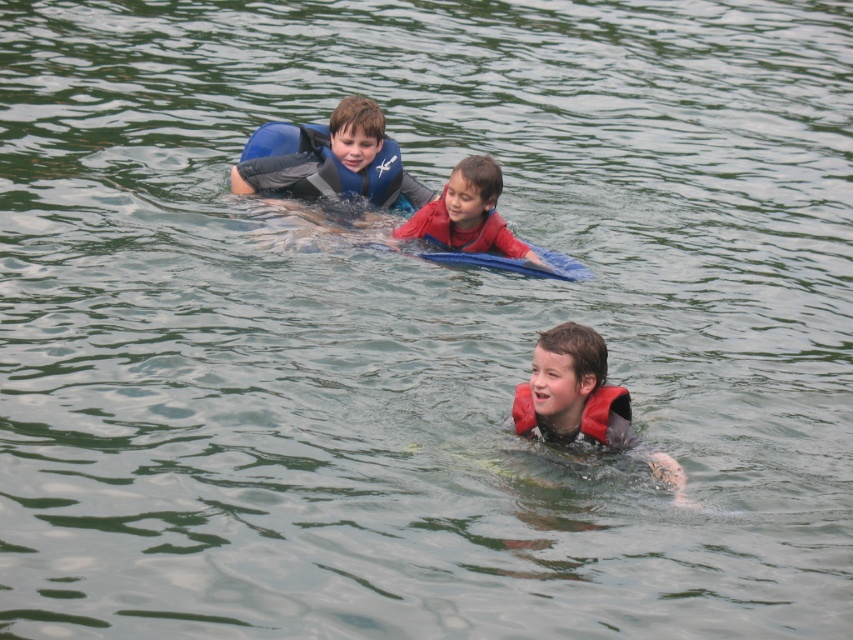
Consider the image. You are a lifeguard observing the scene. There are two red items at the center of the image, a red matte life vest at center and a red matte life jacket at center. Which one is located underneath the other?

The red matte life vest at center is positioned under the red matte life jacket at center.